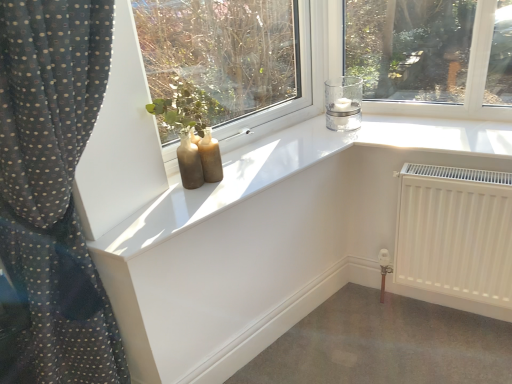
At what (x,y) coordinates should I click in order to perform the action: click on vacant space that is to the left of clear glass candle at upper right. Please return your answer as a coordinate pair (x, y). This screenshot has width=512, height=384. Looking at the image, I should click on (308, 137).